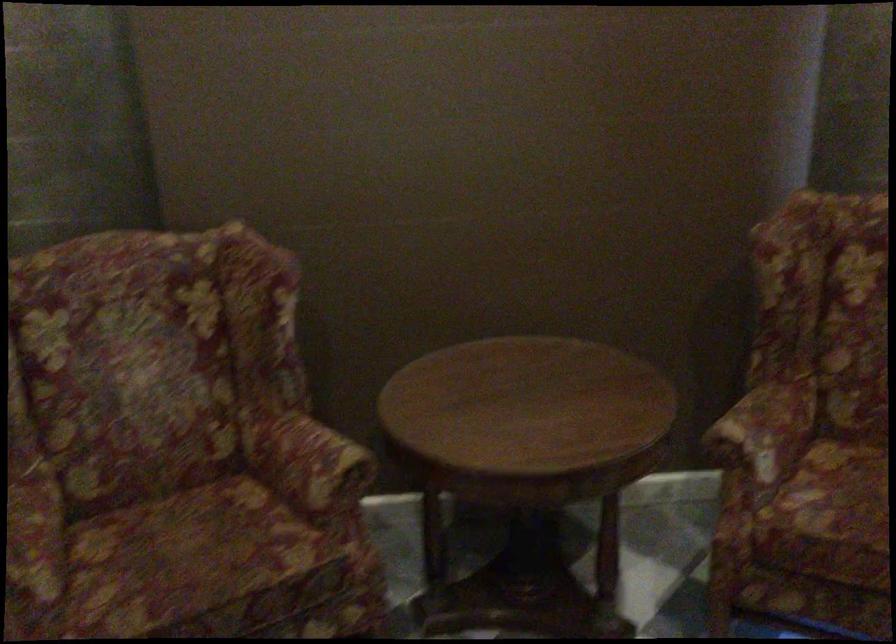
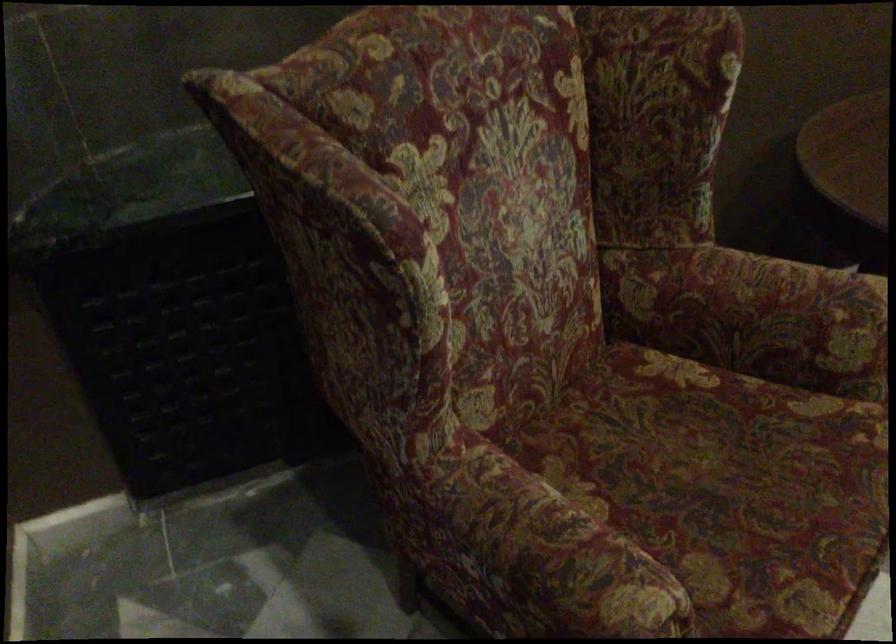
Find the pixel in the second image that matches point (300, 468) in the first image.

(786, 321)